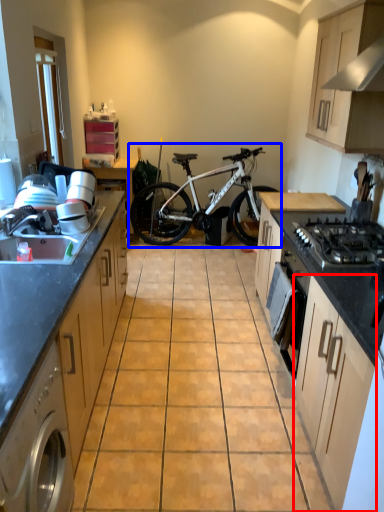
Question: Which of the following is the closest to the observer, cabinetry (highlighted by a red box) or bicycle (highlighted by a blue box)?

Choices:
 (A) cabinetry
 (B) bicycle

Answer: (A)